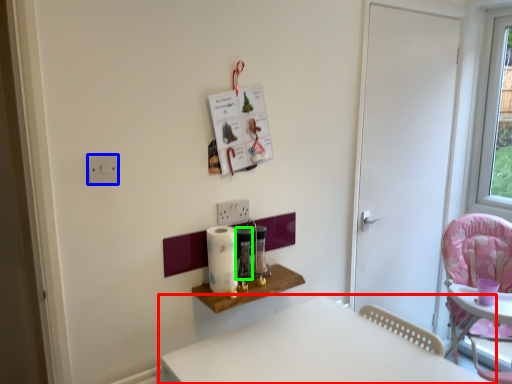
Question: Based on their relative distances, which object is farther from table (highlighted by a red box)? Choose from electric outlet (highlighted by a blue box) and appliance (highlighted by a green box).

Choices:
 (A) electric outlet
 (B) appliance

Answer: (A)